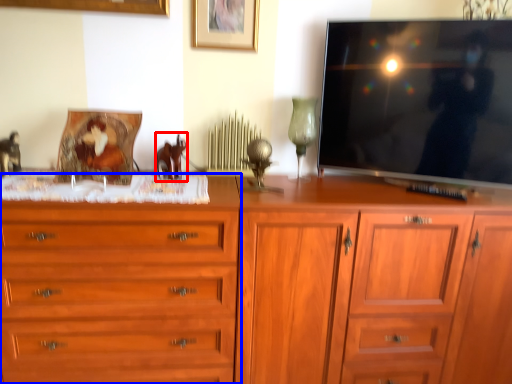
Question: Which of the following is the farthest to the observer, animal (highlighted by a red box) or chest of drawers (highlighted by a blue box)?

Choices:
 (A) animal
 (B) chest of drawers

Answer: (A)